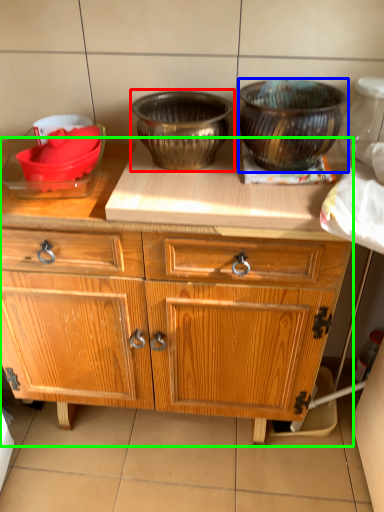
Question: Considering the real-world distances, which object is farthest from bowl (highlighted by a red box)? bowl (highlighted by a blue box) or cabinetry (highlighted by a green box)?

Choices:
 (A) bowl
 (B) cabinetry

Answer: (B)